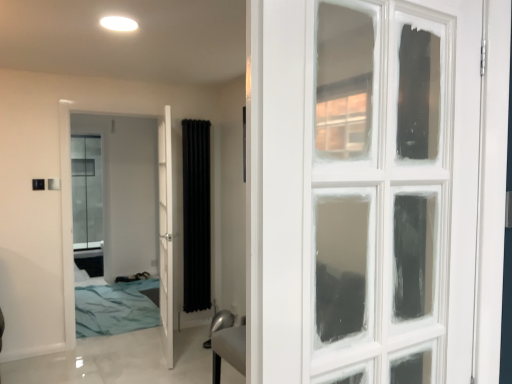
Image resolution: width=512 pixels, height=384 pixels. Find the location of `vacant space situated on the left part of white glossy door at center, which appears as the 2th door when viewed from the left`. vacant space situated on the left part of white glossy door at center, which appears as the 2th door when viewed from the left is located at coordinates (117, 355).